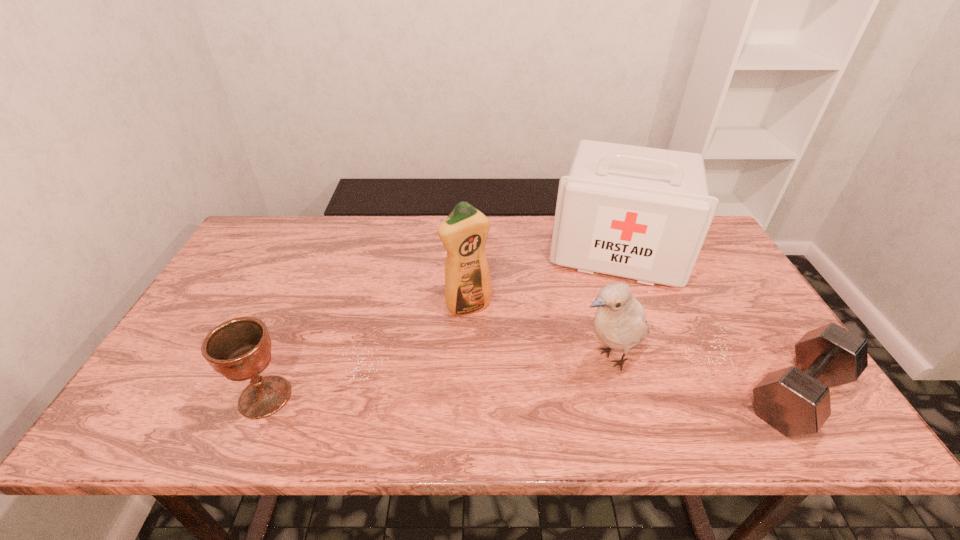
The width and height of the screenshot is (960, 540). I want to click on free space located at the beak of the bird, so click(555, 381).

This screenshot has height=540, width=960. Identify the location of vacant area situated at the beak of the bird. (562, 377).

The width and height of the screenshot is (960, 540). Find the location of `blank space located 0.260m on the label of the detergent`. blank space located 0.260m on the label of the detergent is located at coordinates (527, 393).

Identify the location of vacant space situated on the label of the detergent. (510, 367).

Identify the location of free space located 0.060m on the label of the detergent. The image size is (960, 540). (488, 333).

The image size is (960, 540). Identify the location of free space located on the front-facing side of the first-aid kit. (603, 339).

Image resolution: width=960 pixels, height=540 pixels. What are the coordinates of `free region located on the front-facing side of the first-aid kit` in the screenshot? It's located at (603, 341).

Identify the location of free space located on the front-facing side of the first-aid kit. (603, 339).

Identify the location of object located at the far edge. (642, 213).

Find the location of `chalice located in the near edge section of the desktop`. chalice located in the near edge section of the desktop is located at coordinates (240, 349).